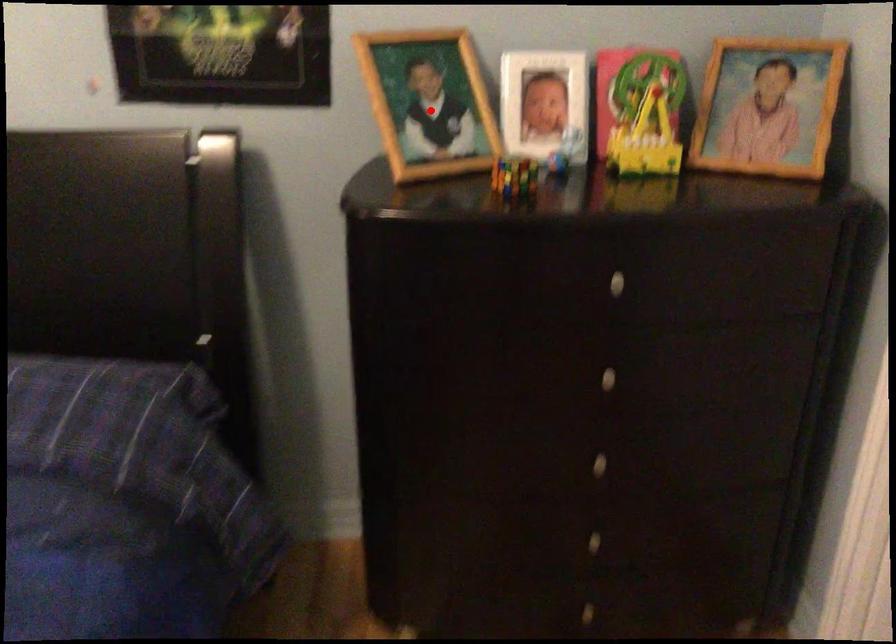
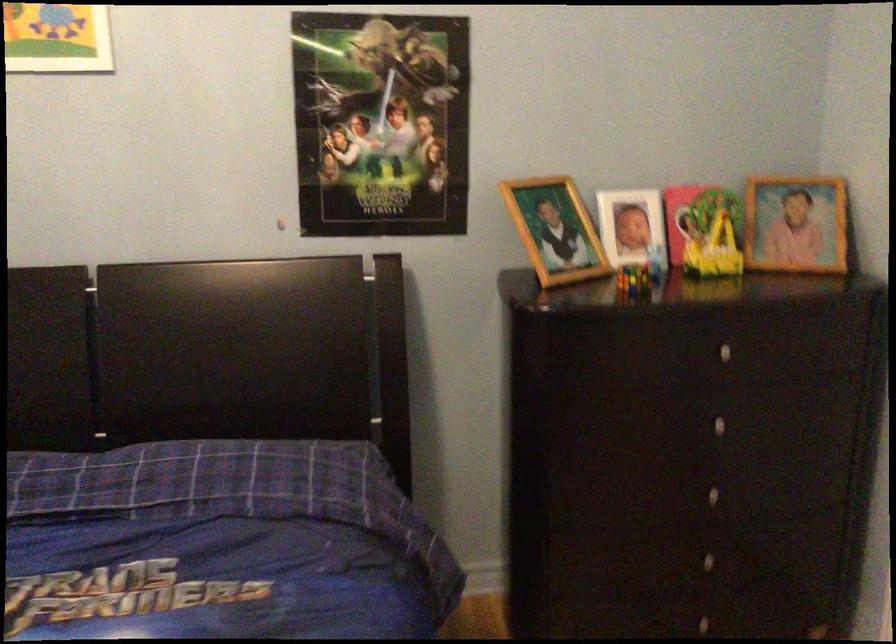
In the second image, find the point that corresponds to the highlighted location in the first image.

(555, 230)